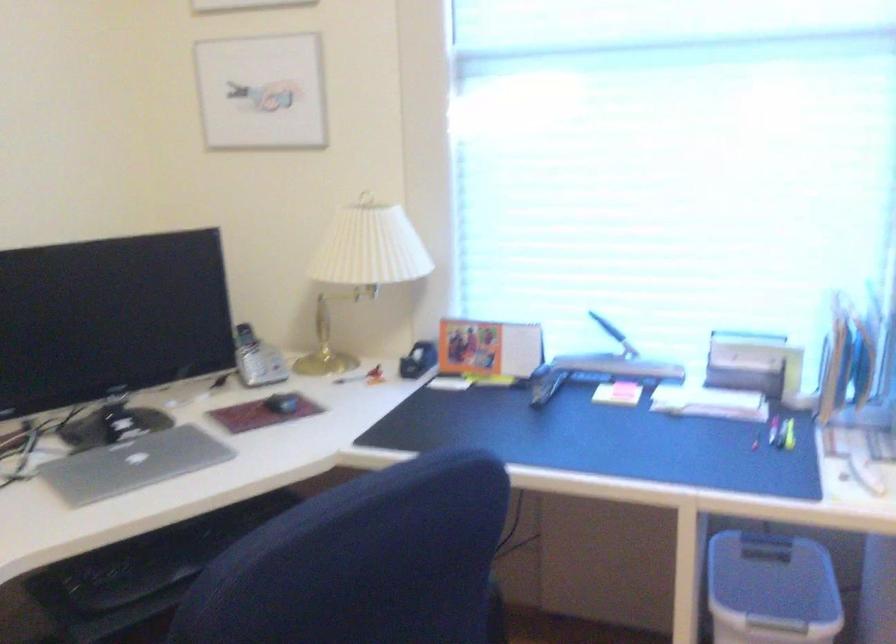
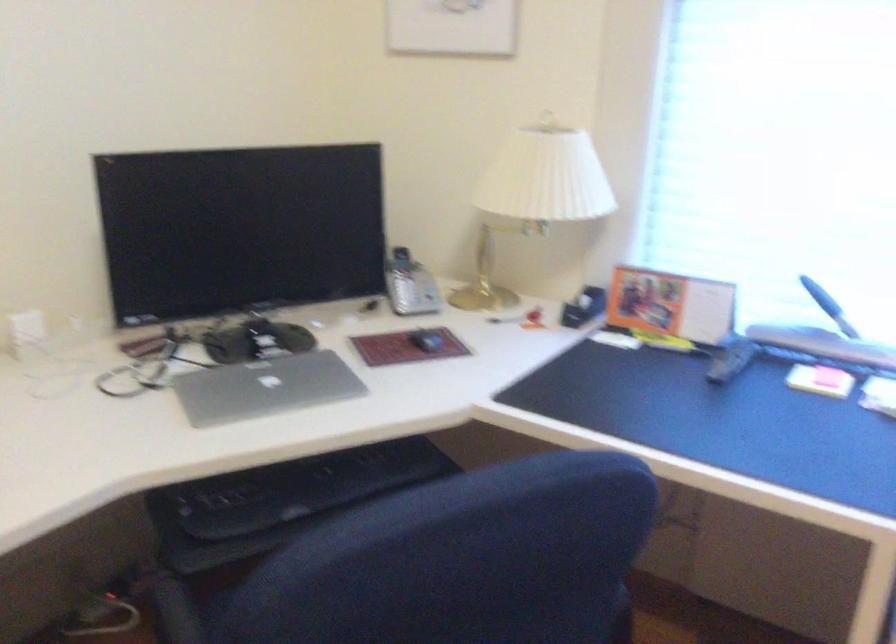
The point at (134, 464) is marked in the first image. Where is the corresponding point in the second image?

(264, 386)